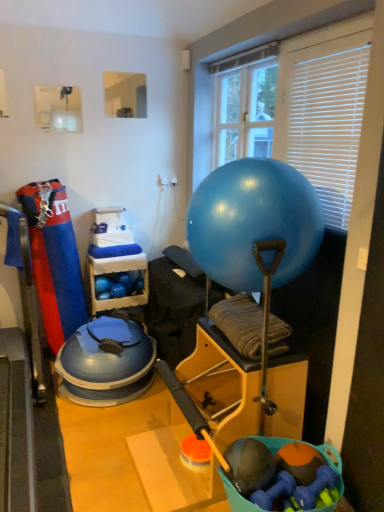
Question: Visually, is white plastic blinds at upper right positioned to the left or to the right of transparent plastic window screen at upper center, arranged as the second window screen when viewed from the left?

Choices:
 (A) left
 (B) right

Answer: (B)

Question: Looking at the image, does white plastic blinds at upper right seem bigger or smaller compared to transparent plastic window screen at upper center, acting as the first window screen starting from the right?

Choices:
 (A) big
 (B) small

Answer: (B)

Question: Estimate the real-world distances between objects in this image. Which object is closer to the clear glass mirror at upper center, acting as the second window screen starting from the right?

Choices:
 (A) transparent plastic window screen at upper center, arranged as the second window screen when viewed from the left
 (B) white plastic blinds at upper right
 (C) blue rubber ball at center
 (D) blue rubber balls at center

Answer: (A)

Question: Estimate the real-world distances between objects in this image. Which object is farther from the white plastic blinds at upper right?

Choices:
 (A) blue rubber balls at center
 (B) clear glass mirror at upper center, acting as the second window screen starting from the right
 (C) blue rubber ball at center
 (D) transparent plastic window screen at upper center, arranged as the second window screen when viewed from the left

Answer: (A)